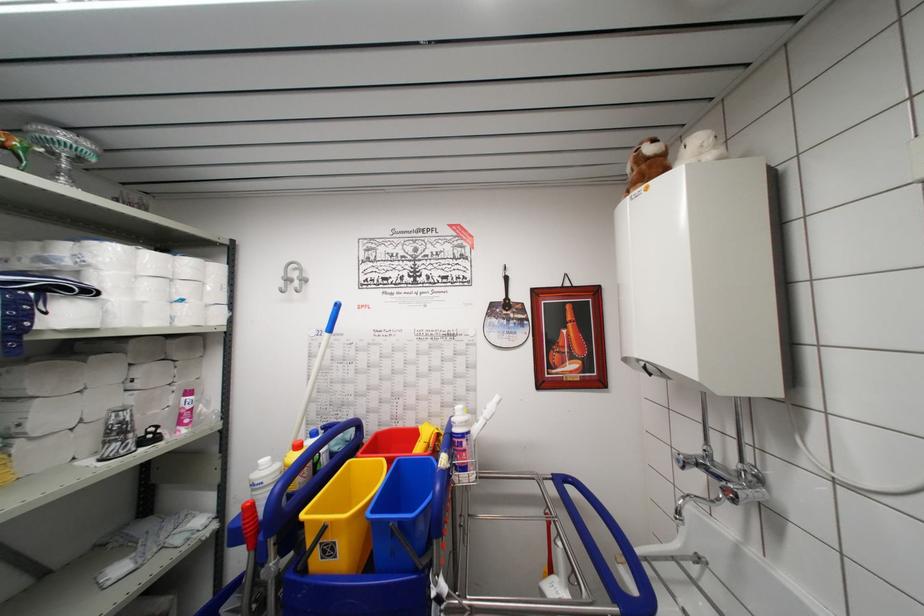
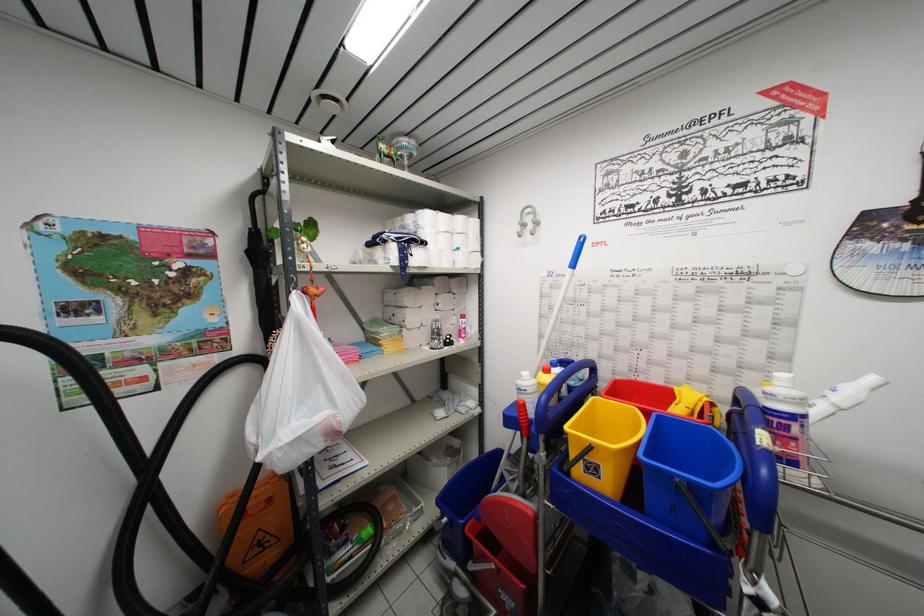
Locate, in the second image, the point that corresponds to [339,309] in the first image.

(584, 241)